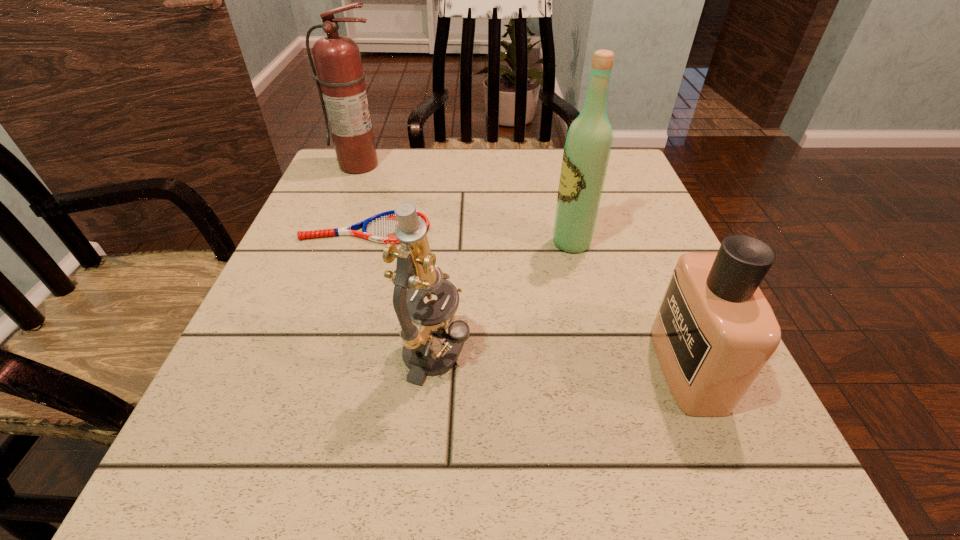
The width and height of the screenshot is (960, 540). Find the location of `object at the far left corner`. object at the far left corner is located at coordinates (340, 81).

You are a GUI agent. You are given a task and a screenshot of the screen. Output one action in this format:
    pyautogui.click(x=<x>, y=<y>)
    Task: Click on the vacant space at the far edge of the desktop
    The height and width of the screenshot is (540, 960).
    Given the screenshot: What is the action you would take?
    pyautogui.click(x=435, y=185)

The image size is (960, 540). In the image, there is a desktop. Identify the location of vacant space at the left edge. (269, 345).

Locate an element on the screen. free region at the right edge is located at coordinates click(x=663, y=260).

Where is `free spot at the far left corner of the desktop`? free spot at the far left corner of the desktop is located at coordinates (341, 170).

Locate an element on the screen. This screenshot has height=540, width=960. vacant area that lies between the fourth object from left to right and the tennis racket is located at coordinates (468, 236).

Where is `free space between the tennis racket and the perfume`? The image size is (960, 540). free space between the tennis racket and the perfume is located at coordinates (527, 298).

Find the location of a particular element. The width and height of the screenshot is (960, 540). vacant space in between the second shortest object and the third shortest object is located at coordinates (563, 360).

Identify the location of vacant area between the perfume and the tennis racket. (527, 298).

This screenshot has height=540, width=960. I want to click on free space between the wine bottle and the microscope, so click(x=504, y=298).